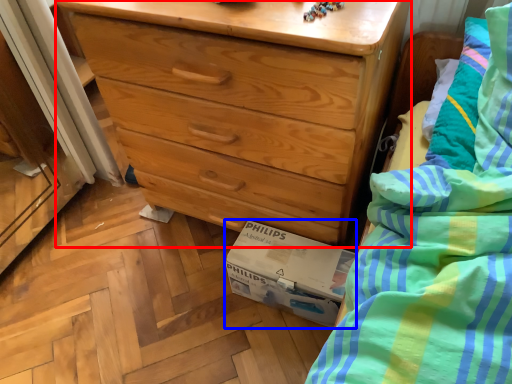
Question: Which point is further to the camera, chest of drawers (highlighted by a red box) or cardboard box (highlighted by a blue box)?

Choices:
 (A) chest of drawers
 (B) cardboard box

Answer: (B)